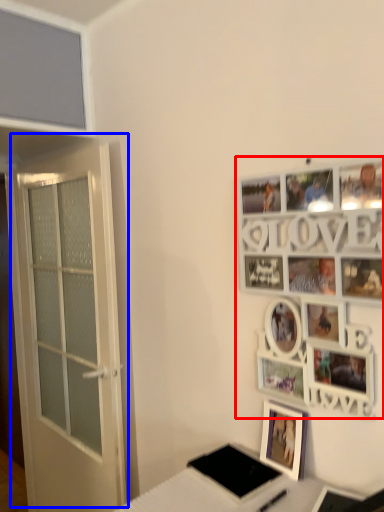
Question: Which object appears farthest to the camera in this image, picture frame (highlighted by a red box) or door (highlighted by a blue box)?

Choices:
 (A) picture frame
 (B) door

Answer: (B)